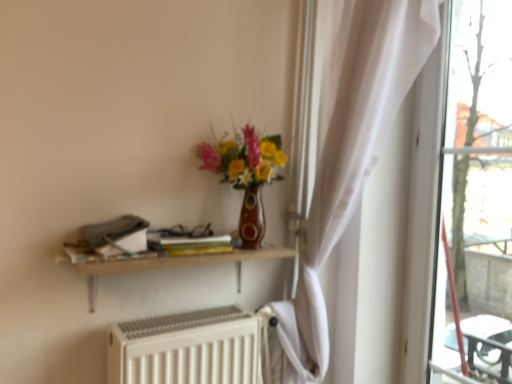
Where is `matte ceramic vase at center`? The image size is (512, 384). matte ceramic vase at center is located at coordinates (246, 174).

At what (x,y) coordinates should I click in order to perform the action: click on white matte radiator at lower center. Please return your answer as a coordinate pair (x, y). The height and width of the screenshot is (384, 512). Looking at the image, I should click on (187, 348).

The image size is (512, 384). Identify the location of yellow matte book at center. (188, 240).

Who is shorter, wooden shelf at upper center or matte ceramic vase at center?

wooden shelf at upper center is shorter.

Is wooden shelf at upper center looking in the opposite direction of matte ceramic vase at center?

No, matte ceramic vase at center is not at the back of wooden shelf at upper center.

Are wooden shelf at upper center and matte ceramic vase at center far apart?

wooden shelf at upper center is near matte ceramic vase at center, not far away.

Between wooden shelf at upper center and matte ceramic vase at center, which one appears on the left side from the viewer's perspective?

Positioned to the left is wooden shelf at upper center.

Is wooden shelf at upper center oriented towards yellow matte book at center?

No.

Which object is thinner, wooden shelf at upper center or yellow matte book at center?

yellow matte book at center.

The height and width of the screenshot is (384, 512). Identify the location of shelf in front of the yellow matte book at center. (172, 264).

Who is bigger, wooden shelf at upper center or yellow matte book at center?

Bigger between the two is wooden shelf at upper center.

Are yellow matte book at center and matte ceramic vase at center far apart?

yellow matte book at center is near matte ceramic vase at center, not far away.

The width and height of the screenshot is (512, 384). I want to click on book below the matte ceramic vase at center (from the image's perspective), so 188,240.

Can you confirm if yellow matte book at center is positioned to the right of matte ceramic vase at center?

No, yellow matte book at center is not to the right of matte ceramic vase at center.

Based on their positions, is yellow matte book at center located to the left or right of wooden shelf at upper center?

From the image, it's evident that yellow matte book at center is to the right of wooden shelf at upper center.

Is yellow matte book at center in contact with wooden shelf at upper center?

Yes, yellow matte book at center is next to wooden shelf at upper center.

Considering the sizes of objects yellow matte book at center and wooden shelf at upper center in the image provided, who is shorter, yellow matte book at center or wooden shelf at upper center?

yellow matte book at center is shorter.

Can you confirm if yellow matte book at center is wider than wooden shelf at upper center?

Incorrect, the width of yellow matte book at center does not surpass that of wooden shelf at upper center.

Is white matte radiator at lower center turned away from yellow matte book at center?

That's not correct — white matte radiator at lower center is not looking away from yellow matte book at center.

From the image's perspective, which one is positioned higher, white matte radiator at lower center or yellow matte book at center?

yellow matte book at center, from the image's perspective.

Is white matte radiator at lower center at the left side of yellow matte book at center?

In fact, white matte radiator at lower center is to the right of yellow matte book at center.

Is matte ceramic vase at center wider than wooden shelf at upper center?

Yes.

Are matte ceramic vase at center and wooden shelf at upper center making contact?

No, matte ceramic vase at center is not with wooden shelf at upper center.

Considering the sizes of objects matte ceramic vase at center and wooden shelf at upper center in the image provided, who is shorter, matte ceramic vase at center or wooden shelf at upper center?

Standing shorter between the two is wooden shelf at upper center.

From the picture: From the image's perspective, is matte ceramic vase at center above or below wooden shelf at upper center?

Based on their image positions, matte ceramic vase at center is located above wooden shelf at upper center.

From a real-world perspective, which is physically above, yellow matte book at center or white matte radiator at lower center?

yellow matte book at center, from a real-world perspective.

Based on their positions, is yellow matte book at center located to the left or right of white matte radiator at lower center?

In the image, yellow matte book at center appears on the left side of white matte radiator at lower center.

Is yellow matte book at center bigger than white matte radiator at lower center?

Actually, yellow matte book at center might be smaller than white matte radiator at lower center.

Would you say white matte radiator at lower center is part of yellow matte book at center's contents?

No, white matte radiator at lower center is not inside yellow matte book at center.

Find the location of `shelf that is on the left side of matte ceramic vase at center`. shelf that is on the left side of matte ceramic vase at center is located at coordinates (172, 264).

The image size is (512, 384). What are the coordinates of `shelf below the yellow matte book at center (from a real-world perspective)` in the screenshot? It's located at (172, 264).

Based on their spatial positions, is wooden shelf at upper center or matte ceramic vase at center further from white matte radiator at lower center?

matte ceramic vase at center lies further to white matte radiator at lower center than the other object.

Looking at the image, which one is located closer to white matte radiator at lower center, yellow matte book at center or matte ceramic vase at center?

Based on the image, yellow matte book at center appears to be nearer to white matte radiator at lower center.

From the image, which object appears to be nearer to wooden shelf at upper center, white matte radiator at lower center or matte ceramic vase at center?

white matte radiator at lower center is closer to wooden shelf at upper center.

Considering their positions, is yellow matte book at center positioned further to matte ceramic vase at center than wooden shelf at upper center?

Among the two, wooden shelf at upper center is located further to matte ceramic vase at center.

Looking at the image, which one is located closer to white matte radiator at lower center, yellow matte book at center or wooden shelf at upper center?

The object closer to white matte radiator at lower center is wooden shelf at upper center.

Looking at the image, which one is located further to matte ceramic vase at center, wooden shelf at upper center or yellow matte book at center?

wooden shelf at upper center lies further to matte ceramic vase at center than the other object.

From the image, which object appears to be farther from wooden shelf at upper center, yellow matte book at center or white matte radiator at lower center?

Based on the image, white matte radiator at lower center appears to be further to wooden shelf at upper center.

Based on their spatial positions, is yellow matte book at center or white matte radiator at lower center closer to matte ceramic vase at center?

yellow matte book at center is positioned closer to the anchor matte ceramic vase at center.

At what (x,y) coordinates should I click in order to perform the action: click on shelf between yellow matte book at center and white matte radiator at lower center vertically. Please return your answer as a coordinate pair (x, y). Image resolution: width=512 pixels, height=384 pixels. Looking at the image, I should click on (172, 264).

The height and width of the screenshot is (384, 512). I want to click on book between matte ceramic vase at center and white matte radiator at lower center in the vertical direction, so click(188, 240).

Identify the location of book between matte ceramic vase at center and wooden shelf at upper center in the vertical direction. The image size is (512, 384). (188, 240).

Where is `shelf between matte ceramic vase at center and white matte radiator at lower center in the up-down direction`? shelf between matte ceramic vase at center and white matte radiator at lower center in the up-down direction is located at coordinates click(172, 264).